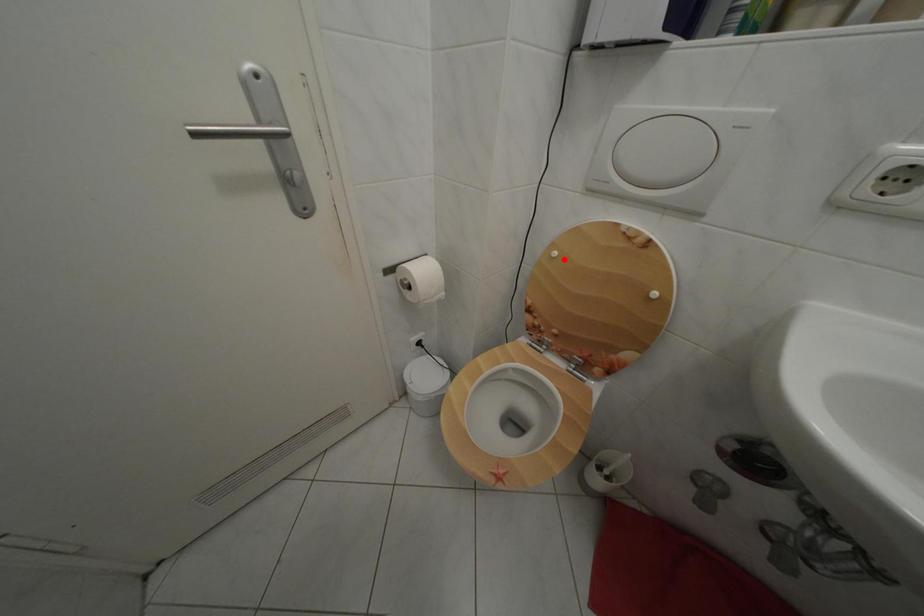
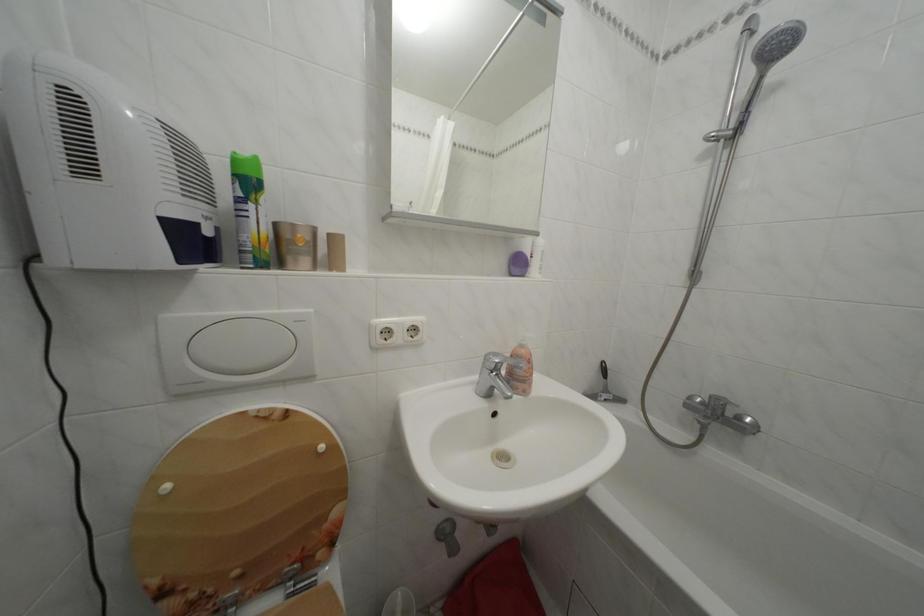
Locate, in the second image, the point that corresponds to the highlighted location in the first image.

(176, 493)